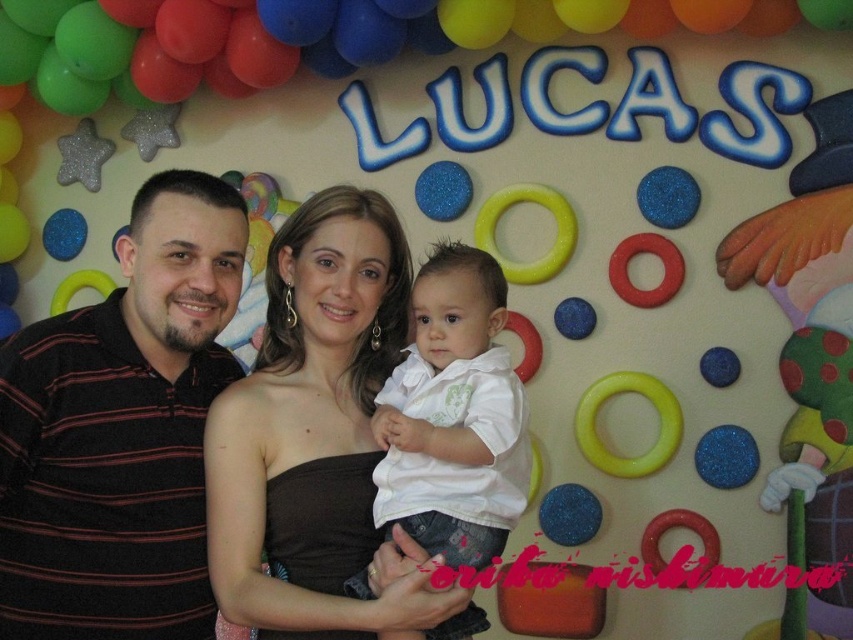
Does striped polo shirt at left have a greater height compared to matte white dress at center?

Yes, striped polo shirt at left is taller than matte white dress at center.

Does striped polo shirt at left lie behind matte white dress at center?

No, it is not.

Who is more forward, (142,624) or (338,593)?

Positioned in front is point (142,624).

Where is `striped polo shirt at left`? Image resolution: width=853 pixels, height=640 pixels. striped polo shirt at left is located at coordinates (120, 429).

Between matte white dress at center and green matte balloon at upper center, which one has less height?

green matte balloon at upper center is shorter.

Who is higher up, matte white dress at center or green matte balloon at upper center?

Positioned higher is green matte balloon at upper center.

Does point (376, 328) lie behind point (781, 19)?

No, it is in front of (781, 19).

Where is `matte white dress at center`? matte white dress at center is located at coordinates (316, 436).

Who is higher up, green matte balloon at upper center or white matte shirt at center?

Positioned higher is green matte balloon at upper center.

Can you confirm if green matte balloon at upper center is positioned to the right of white matte shirt at center?

No, green matte balloon at upper center is not to the right of white matte shirt at center.

In order to click on green matte balloon at upper center in this screenshot , I will do `click(312, 36)`.

I want to click on green matte balloon at upper center, so click(312, 36).